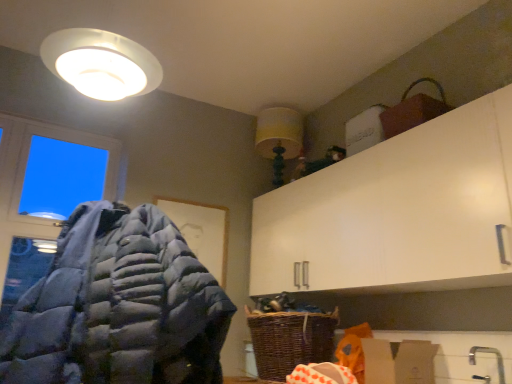
Question: Is brown cardboard box at lower right in front of or behind transparent glass window at upper left in the image?

Choices:
 (A) front
 (B) behind

Answer: (A)

Question: Based on their positions, is brown cardboard box at lower right located to the left or right of transparent glass window at upper left?

Choices:
 (A) left
 (B) right

Answer: (B)

Question: Estimate the real-world distances between objects in this image. Which object is farther from the woven brown basket at lower center?

Choices:
 (A) brown cardboard box at lower right
 (B) gray down jacket at left
 (C) transparent glass window at upper left
 (D) yellow fabric lampshade at upper center

Answer: (C)

Question: Based on their relative distances, which object is farther from the brown cardboard box at lower right?

Choices:
 (A) woven brown basket at lower center
 (B) transparent glass window at upper left
 (C) yellow fabric lampshade at upper center
 (D) gray down jacket at left

Answer: (B)